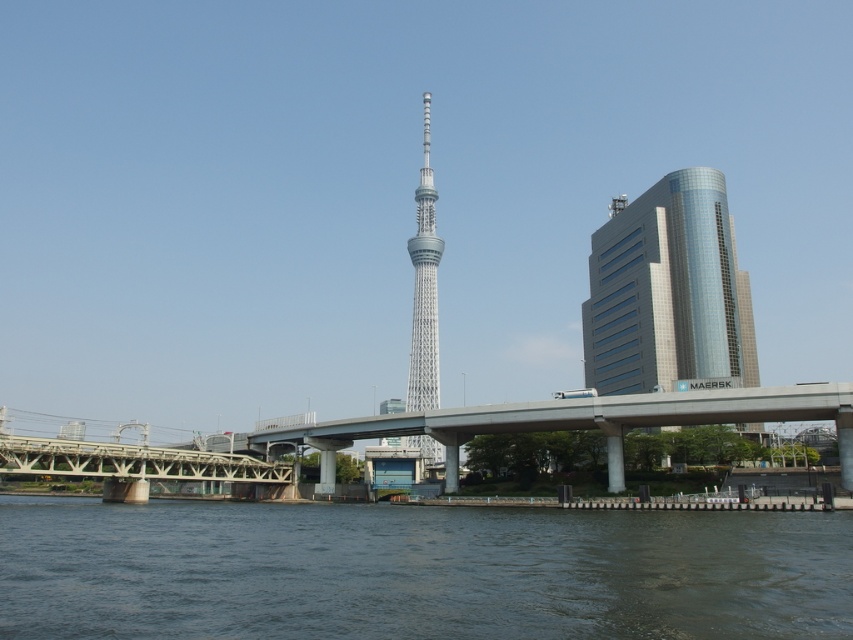
You are a photographer planning to capture the silver metallic tv tower at center and the dark gray water at lower center in a single shot. Based on their sizes in the image, which object will occupy more of the frame?

The silver metallic tv tower at center is larger than the dark gray water at lower center, so it will occupy more of the frame.